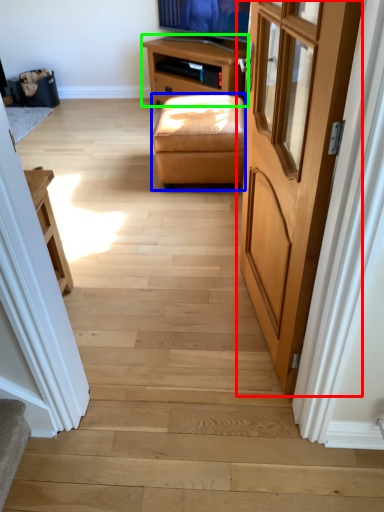
Question: Which object is positioned closest to door (highlighted by a red box)? Select from stool (highlighted by a blue box) and table (highlighted by a green box).

Choices:
 (A) stool
 (B) table

Answer: (A)